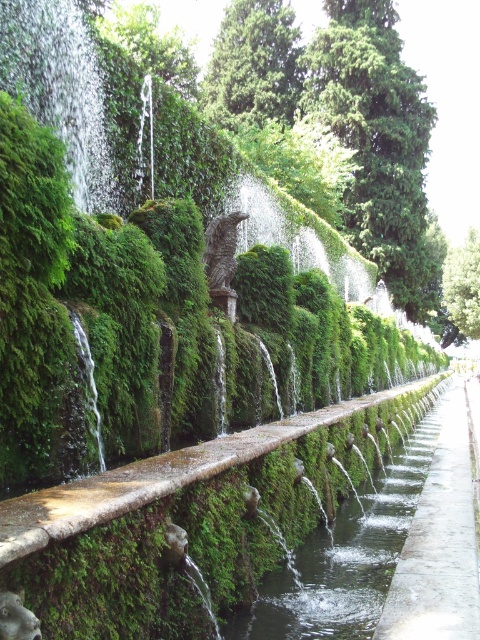
Is clear water at center shorter than green mossy wall at upper left?

Yes.

Can you confirm if clear water at center is positioned to the right of green mossy wall at upper left?

Correct, you'll find clear water at center to the right of green mossy wall at upper left.

Locate an element on the screen. This screenshot has width=480, height=640. clear water at center is located at coordinates (347, 556).

You are a GUI agent. You are given a task and a screenshot of the screen. Output one action in this format:
    pyautogui.click(x=<x>, y=<y>)
    Task: Click on the clear water at center
    The height and width of the screenshot is (640, 480).
    Given the screenshot: What is the action you would take?
    pyautogui.click(x=347, y=556)

Is clear water at center bigger than concrete at center?

No, clear water at center is not bigger than concrete at center.

Does point (289, 589) lie in front of point (442, 596)?

No, it is not.

You are a GUI agent. You are given a task and a screenshot of the screen. Output one action in this format:
    pyautogui.click(x=<x>, y=<y>)
    Task: Click on the clear water at center
    This screenshot has width=480, height=640.
    Given the screenshot: What is the action you would take?
    pyautogui.click(x=347, y=556)

Who is positioned more to the left, concrete at center or green mossy wall at upper left?

Positioned to the left is green mossy wall at upper left.

Find the location of `concrete at center`. concrete at center is located at coordinates (439, 545).